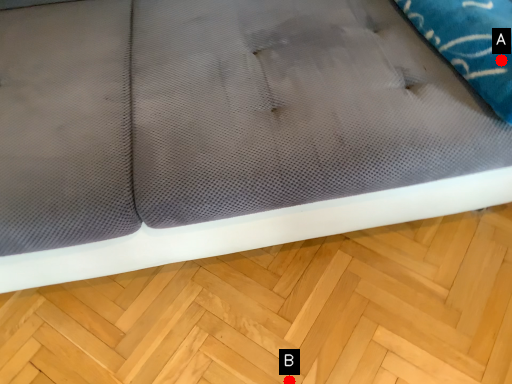
Question: Two points are circled on the image, labeled by A and B beside each circle. Which point is further to the camera?

Choices:
 (A) A is further
 (B) B is further

Answer: (B)